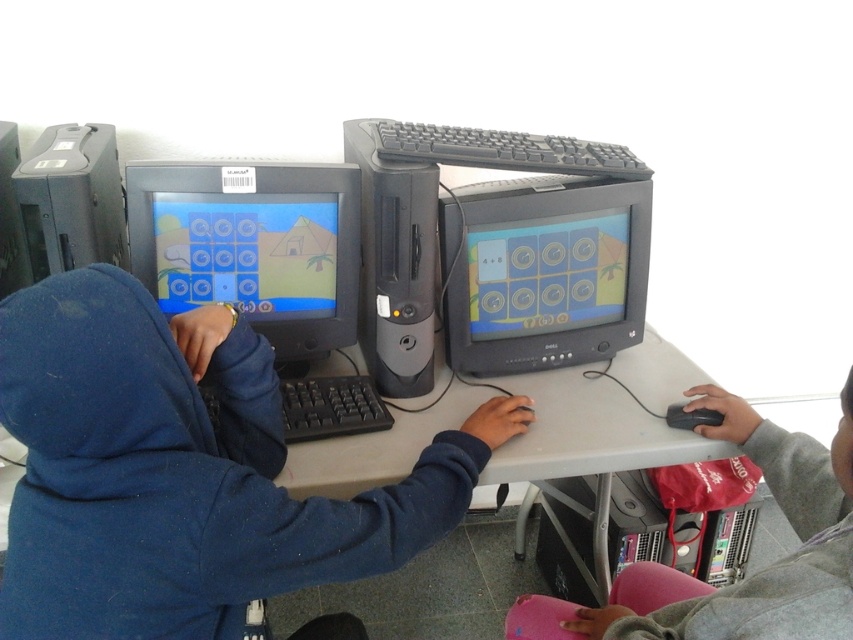
You are a student trying to reach for your mouse while sitting at the table. Which mouse, the gray matte mouse at lower right or the black plastic mouse at lower right, is closer to the edge of the table?

The gray matte mouse at lower right is closer to the edge of the table because it is located below the black plastic mouse at lower right, meaning it is positioned further outward.

You are a student sitting at the table in the classroom. You need to locate the gray matte mouse at lower right. Based on the coordinates provided, can you estimate its position relative to the edge of the table?

The gray matte mouse at lower right is located at coordinates point (778,561), meaning it is positioned closer to the lower right edge of the table.

You are a technician trying to troubleshoot an issue with the matte black monitor at center and the black plastic computer tower at lower center. You need to know which one is taller to determine if there is a clearance issue. Which object is taller?

The matte black monitor at center is taller than the black plastic computer tower at lower center, so there may be a clearance issue if the monitor is too tall for the space provided.